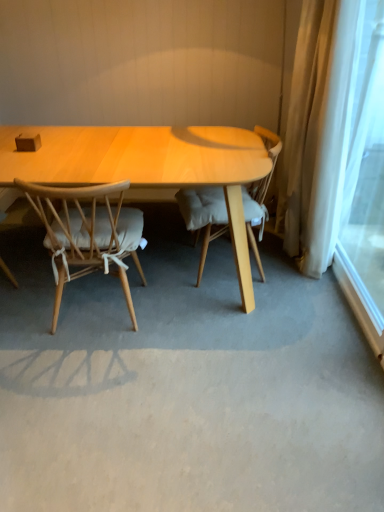
This screenshot has width=384, height=512. Find the location of `empty space that is to the right of light wood chair with cushion at left, arranged as the 2th chair when viewed from the right`. empty space that is to the right of light wood chair with cushion at left, arranged as the 2th chair when viewed from the right is located at coordinates (188, 321).